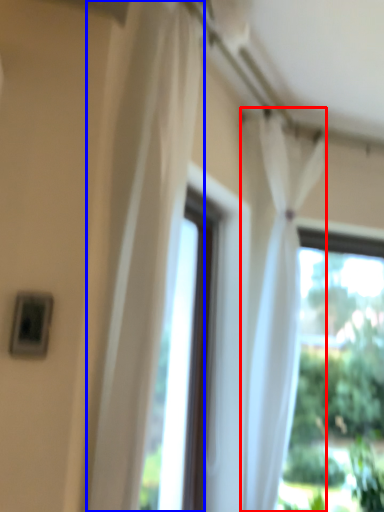
Question: Which object is further to the camera taking this photo, curtain (highlighted by a red box) or curtain (highlighted by a blue box)?

Choices:
 (A) curtain
 (B) curtain

Answer: (A)